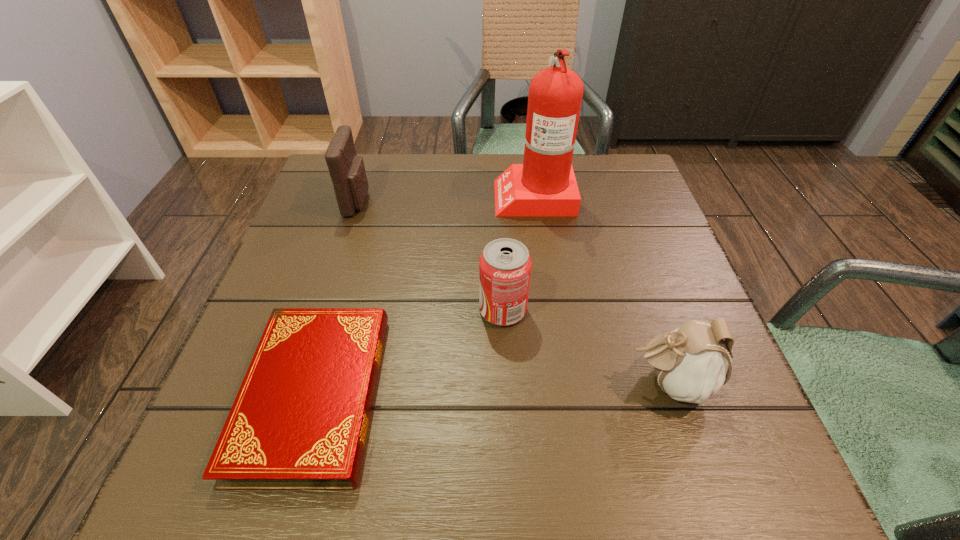
Where is `the tallest object`? This screenshot has width=960, height=540. the tallest object is located at coordinates (544, 185).

Where is `the farther pouch`? The width and height of the screenshot is (960, 540). the farther pouch is located at coordinates (347, 171).

You are a GUI agent. You are given a task and a screenshot of the screen. Output one action in this format:
    pyautogui.click(x=<x>, y=<y>)
    Task: Click on the soda can
    
    Given the screenshot: What is the action you would take?
    coord(505,265)

Find the location of a particular element. The width and height of the screenshot is (960, 540). the rightmost object is located at coordinates (692, 362).

Image resolution: width=960 pixels, height=540 pixels. In order to click on the right pouch in this screenshot , I will do `click(692, 362)`.

What are the coordinates of `hardback book` in the screenshot? It's located at (300, 419).

Locate an element on the screen. The image size is (960, 540). vacant space located on the front-facing side of the fire extinguisher is located at coordinates (426, 195).

Identify the location of vacant space positioned on the front-facing side of the fire extinguisher. point(346,195).

Where is `free spot located 0.390m on the front-facing side of the fire extinguisher`? The image size is (960, 540). free spot located 0.390m on the front-facing side of the fire extinguisher is located at coordinates (338, 195).

This screenshot has height=540, width=960. I want to click on free location located with an open flap on the left pouch, so click(x=402, y=201).